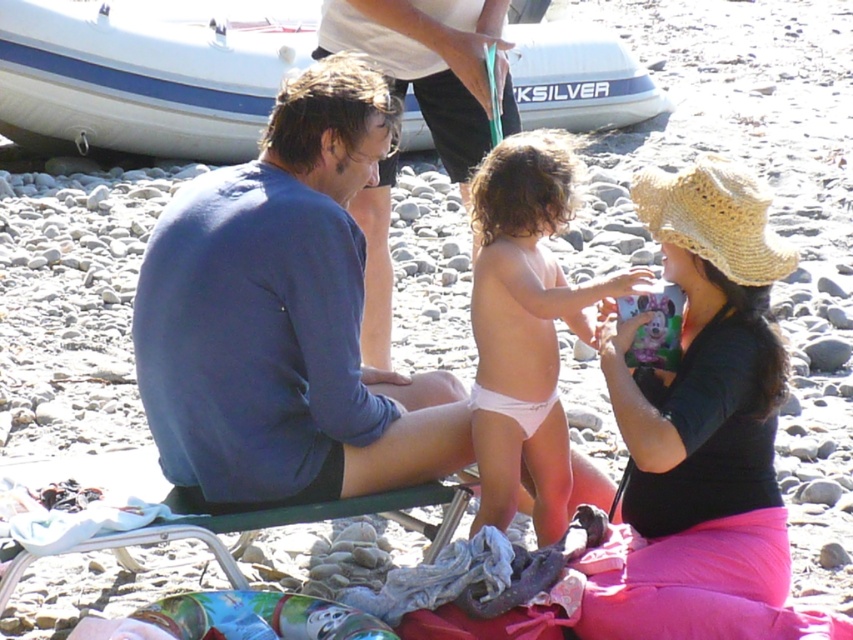
You are a photographer trying to capture a candid shot of the two adults and the child in the scene. You notice the blue cotton shirt at center and the straw hat at upper right. Which object should you focus on first if you want to include both in the frame without moving the camera?

The blue cotton shirt at center is much taller than the straw hat at upper right, so you should focus on the blue cotton shirt at center first to ensure both are in the frame.